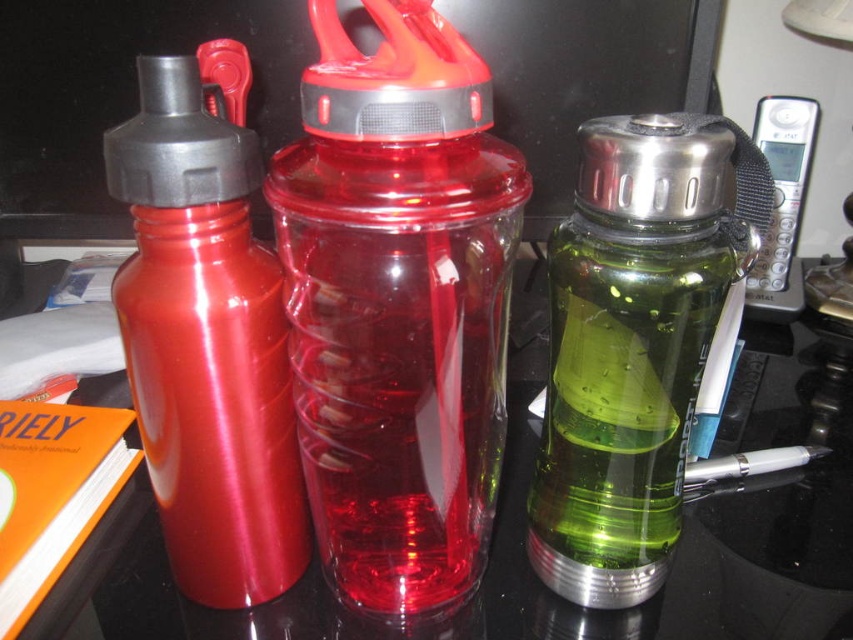
You are a delivery robot with a 12 inch wide arm. You need to place a package between the green translucent water bottle at center and the edge of the table. Is there enough space for your arm to fit?

The green translucent water bottle at center and viewer are 13.25 inches apart. Since the robot arm is 12 inches wide, there is enough space for the arm to fit between the bottle and the edge of the table.